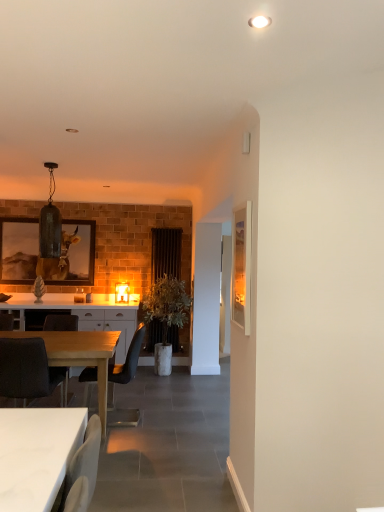
Question: Considering the relative positions of wooden framed artwork at left, placed as the 1th picture frame when sorted from left to right, and white glossy table at lower left, the 1th desk positioned from the right, in the image provided, is wooden framed artwork at left, placed as the 1th picture frame when sorted from left to right, to the left or to the right of white glossy table at lower left, the 1th desk positioned from the right,?

Choices:
 (A) left
 (B) right

Answer: (A)

Question: Which is correct: wooden framed artwork at left, placed as the 1th picture frame when sorted from left to right, is inside white glossy table at lower left, the 2th desk from the left, or outside of it?

Choices:
 (A) inside
 (B) outside

Answer: (B)

Question: Estimate the real-world distances between objects in this image. Which object is farther from the matte glass pendant light at upper left, which ranks as the 1th lamp in top-to-bottom order?

Choices:
 (A) dark gray fabric chair at lower left, which is the 1th chair in back-to-front order
 (B) wooden picture frame at right, the 1th picture frame in the front-to-back sequence
 (C) white glossy table at lower left, positioned as the 2th desk in back-to-front order
 (D) light wood table at lower left, which is counted as the first desk, starting from the left
 (E) matte black chair at center, marked as the second chair in a front-to-back arrangement

Answer: (C)

Question: Which of these objects is positioned closest to the white glossy cabinet at center?

Choices:
 (A) matte glass pendant light at upper left, positioned as the 2th lamp in back-to-front order
 (B) matte black chair at center, marked as the 2th chair in a back-to-front arrangement
 (C) matte glass lampshade at center, which is the second lamp from front to back
 (D) light wood table at lower left, which is counted as the first desk, starting from the left
 (E) black fabric chair at lower left, which ranks as the 1th chair in front-to-back order

Answer: (B)